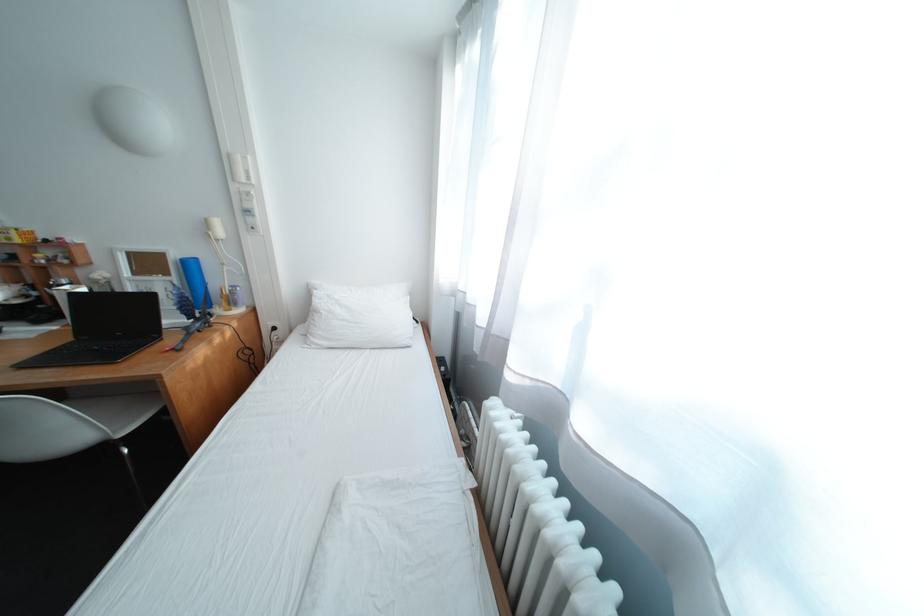
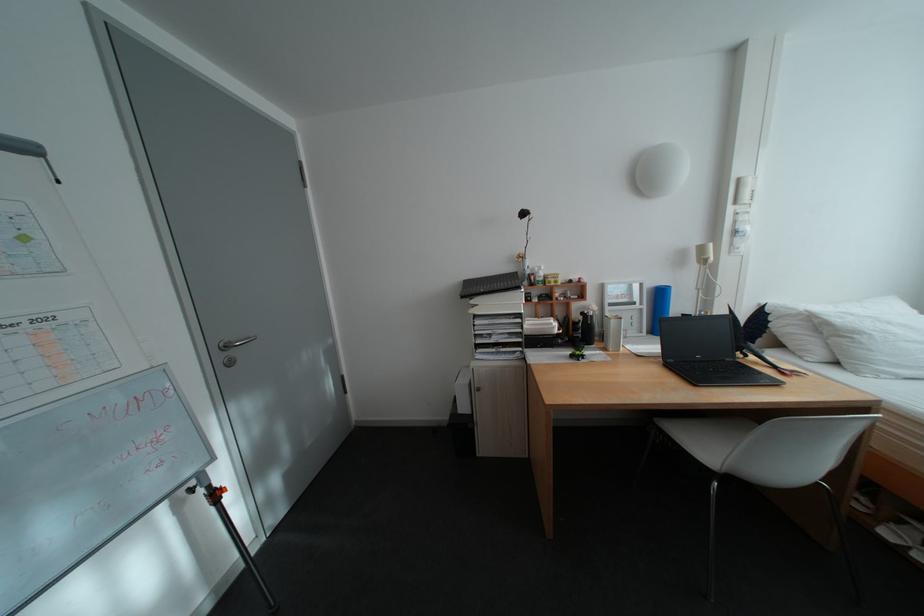
In the second image, find the point that corresponds to point (330, 314) in the first image.

(871, 334)